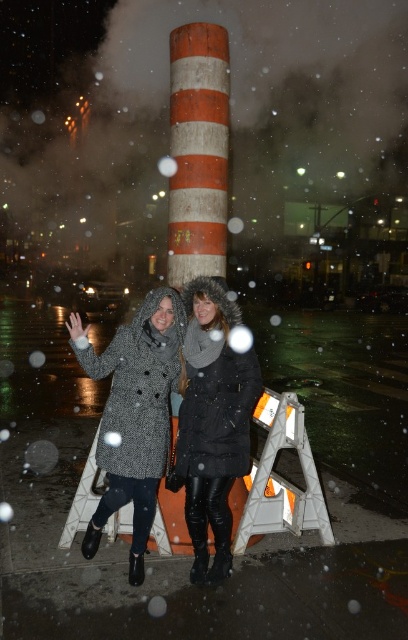
Consider the image. You are a delivery person who needs to determine which coat to wear for a short outdoor task. You have both the textured wool coat at center and the black leather coat at center available. Based on their sizes, which coat would provide more warmth?

The textured wool coat at center is larger in size than the black leather coat at center, so it would provide more warmth due to its bulkier design.

You are trying to decide which coat to approach first. The textured wool coat at center and the black leather coat at center are both in your line of sight. Which one would you reach first if you move straight ahead?

The textured wool coat at center is closer to the viewer than the black leather coat at center, so you would reach the textured wool coat at center first when moving straight ahead.